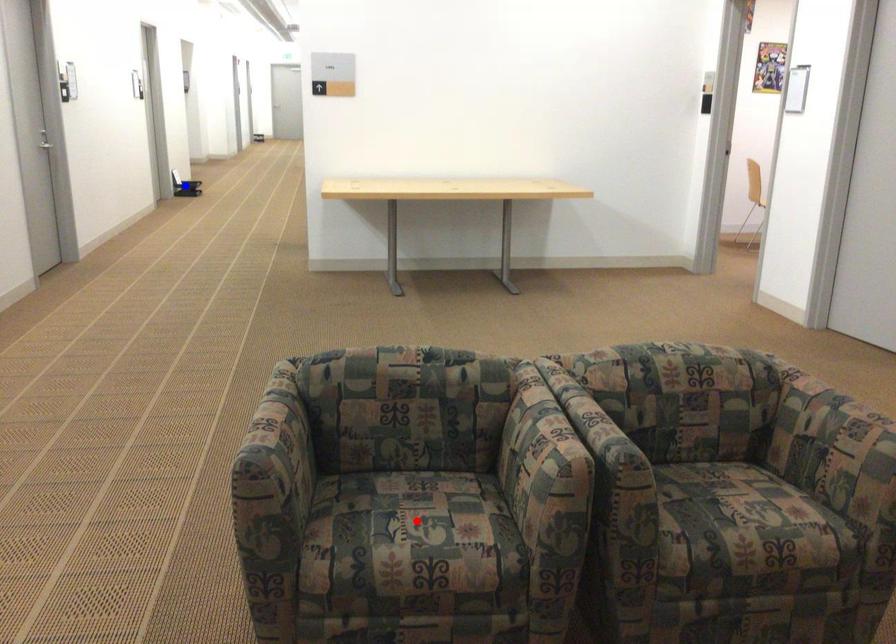
Question: Which of the two points in the image is closer to the camera?

Choices:
 (A) Blue point is closer.
 (B) Red point is closer.

Answer: (B)